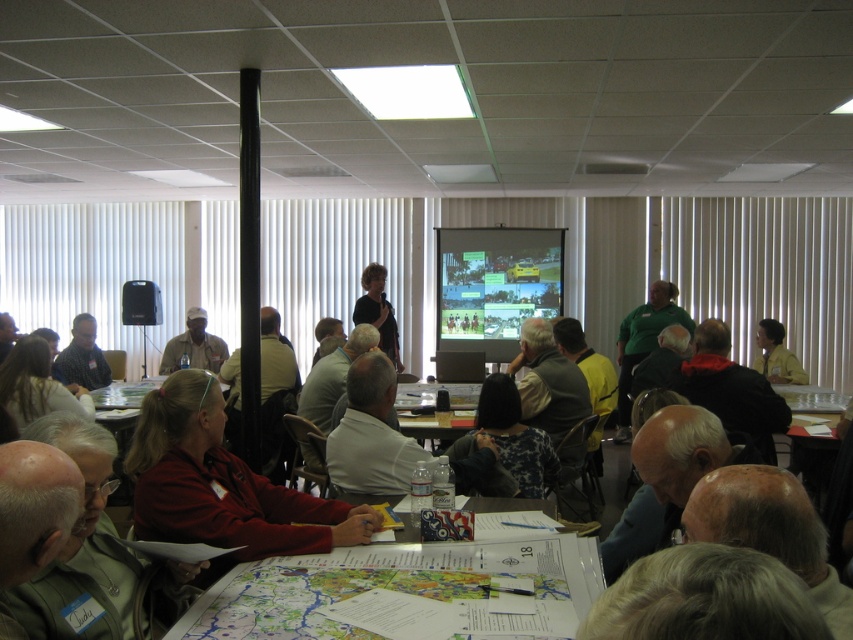
Consider the image. Can you confirm if matte black shirt at center is positioned to the right of yellow fabric at center?

Incorrect, matte black shirt at center is not on the right side of yellow fabric at center.

Where is `matte black shirt at center`? This screenshot has height=640, width=853. matte black shirt at center is located at coordinates (378, 310).

Can you confirm if wooden table at center is thinner than yellow fabric at center?

No.

Does wooden table at center have a greater height compared to yellow fabric at center?

In fact, wooden table at center may be shorter than yellow fabric at center.

Which is in front, point (445, 428) or point (770, 362)?

Positioned in front is point (445, 428).

The height and width of the screenshot is (640, 853). What are the coordinates of `wooden table at center` in the screenshot? It's located at (433, 412).

Which is below, red matte shirt at lower left or blonde hair at lower left?

red matte shirt at lower left is below.

Where is `red matte shirt at lower left`? This screenshot has height=640, width=853. red matte shirt at lower left is located at coordinates (222, 483).

Between point (329, 516) and point (50, 378), which one is positioned in front?

Positioned in front is point (329, 516).

Image resolution: width=853 pixels, height=640 pixels. I want to click on red matte shirt at lower left, so click(x=222, y=483).